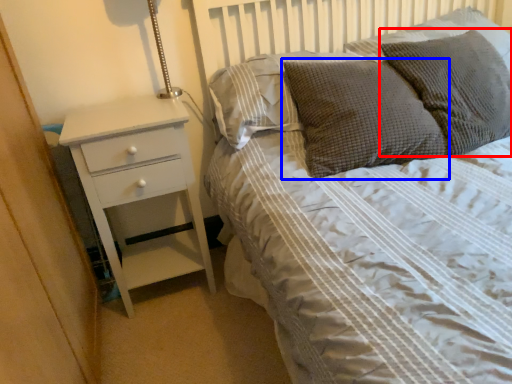
Question: Which of the following is the closest to the observer, pillow (highlighted by a red box) or pillow (highlighted by a blue box)?

Choices:
 (A) pillow
 (B) pillow

Answer: (A)